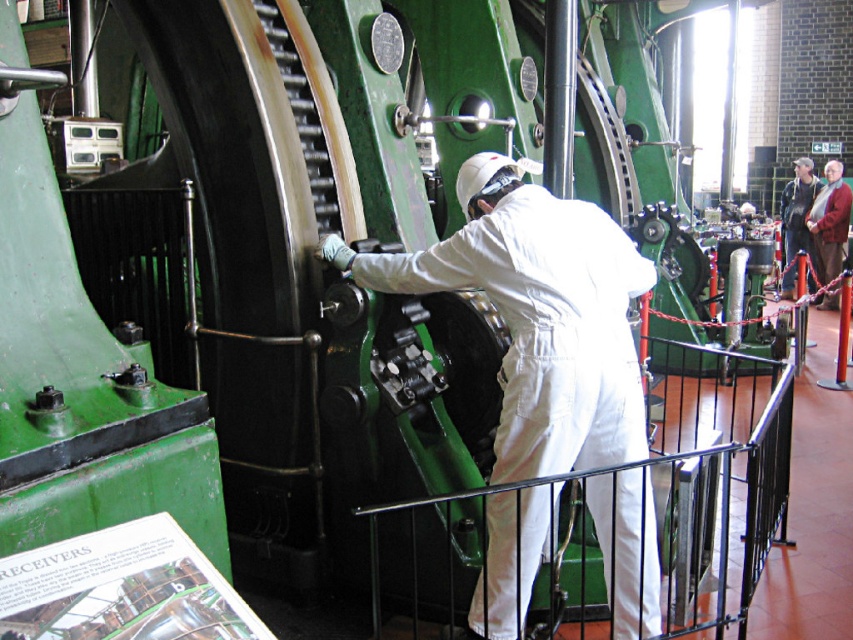
You are an inspector in this steam engine room. You need to determine if the white matte coveralls at center can be used to cover the red woolen robe at right completely. Based on their sizes, what would you conclude?

The white matte coveralls at center has a larger size compared to the red woolen robe at right, so it can be used to cover the red woolen robe at right completely.

You are a maintenance worker in the steam engine room. You need to locate your colleague who is wearing white matte coveralls at center. According to the coordinates provided, where should you look to find them?

The white matte coveralls at center is located at the coordinates point (537, 314).